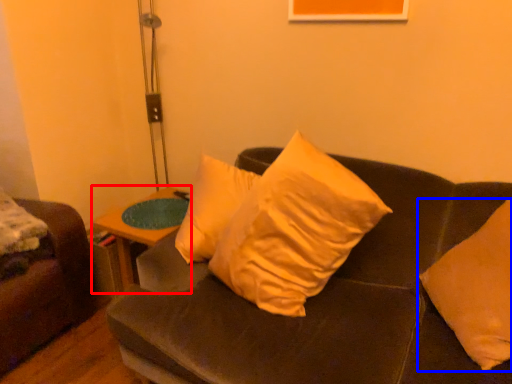
Question: Which object appears farthest to the camera in this image, table (highlighted by a red box) or pillow (highlighted by a blue box)?

Choices:
 (A) table
 (B) pillow

Answer: (A)